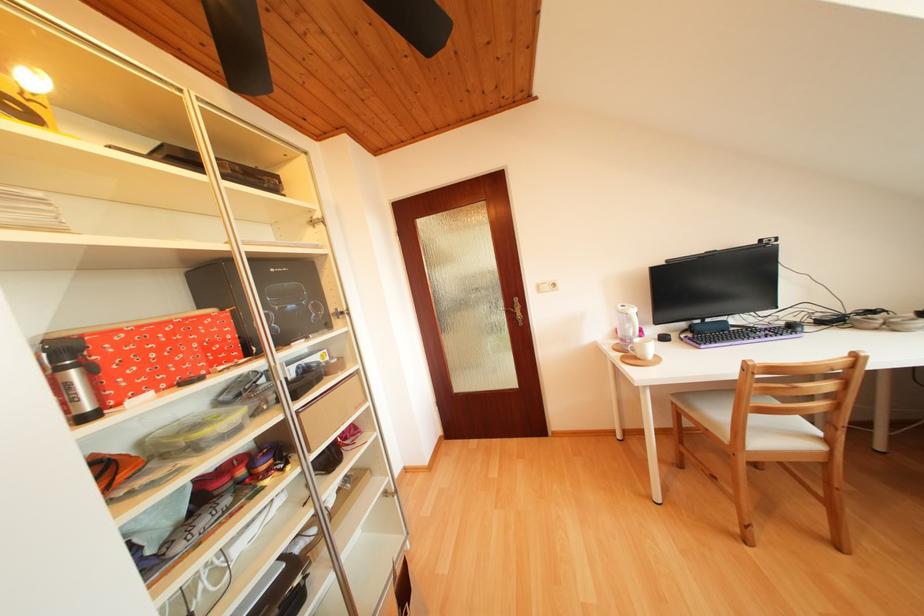
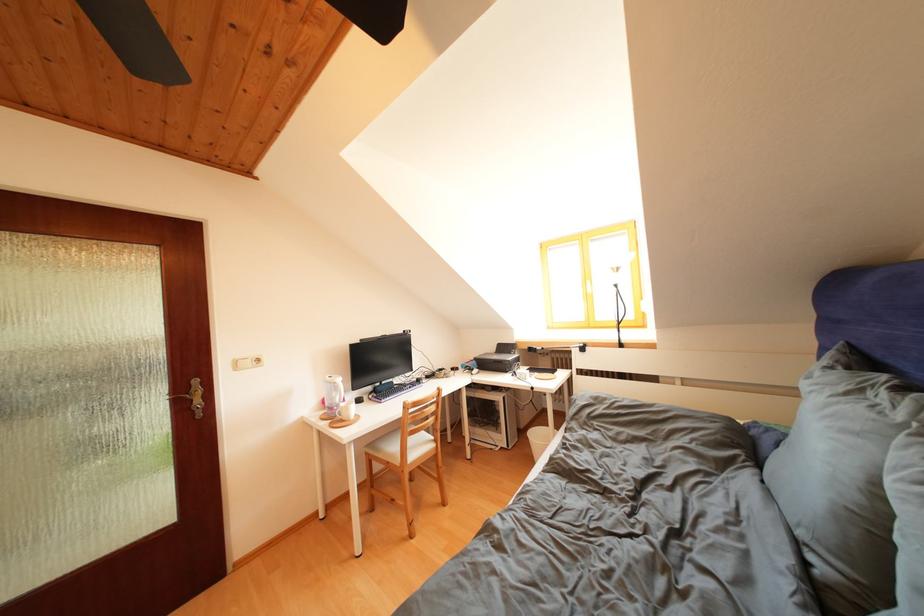
In the second image, find the point that corresponds to [645,345] in the first image.

(350, 410)